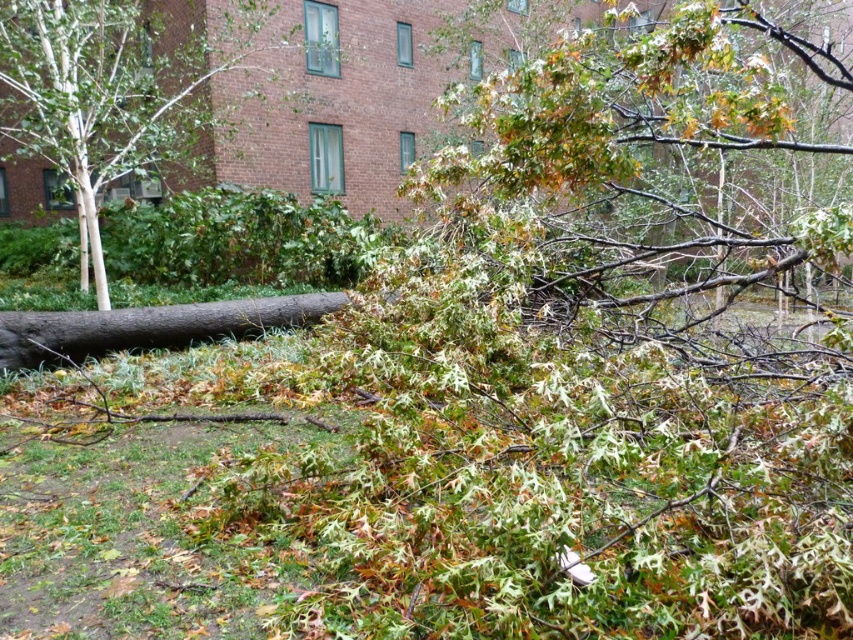
You are a rescue worker assessing the scene. You notice the green leafy branches at upper right and the smooth white bark at left. Which object is positioned more to the east if the image is oriented with north at the top?

The green leafy branches at upper right is positioned more to the east than the smooth white bark at left because it is to the right of it in the image, and the image is oriented with north at the top.

You are a drone operator tasked with assessing damage after a storm. You need to locate the green leafy branches at upper right in the image. What are their coordinates?

The green leafy branches at upper right are located at coordinates point (630, 116).

You are a cleanup crew member assessing the damage. You see the green leafy branches at upper right and the smooth white bark at left. Which object requires more effort to clear due to its size?

The green leafy branches at upper right requires more effort to clear because it is bigger than the smooth white bark at left.